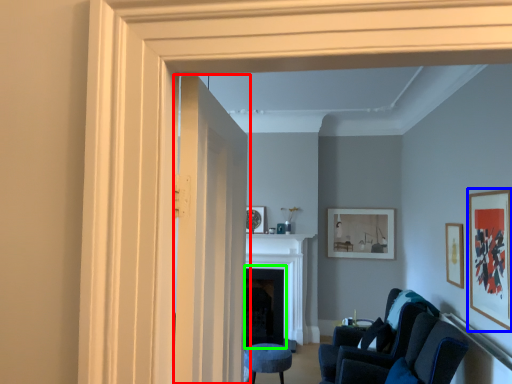
Question: Considering the real-world distances, which object is farthest from door (highlighted by a red box)? picture frame (highlighted by a blue box) or fireplace (highlighted by a green box)?

Choices:
 (A) picture frame
 (B) fireplace

Answer: (B)